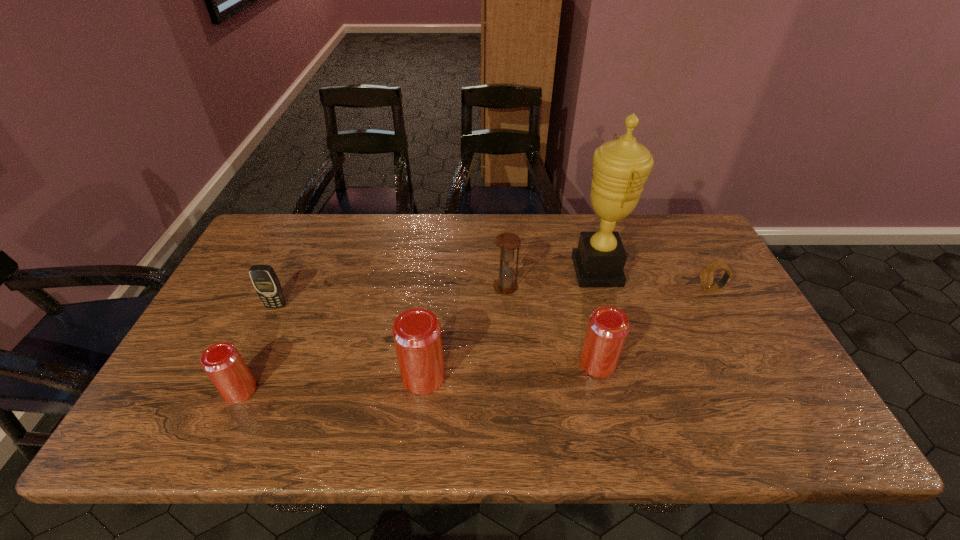
Where is `beer can positioned at the left edge`? The width and height of the screenshot is (960, 540). beer can positioned at the left edge is located at coordinates (222, 362).

The image size is (960, 540). In order to click on cellular telephone at the left edge in this screenshot , I will do `click(266, 283)`.

Where is `object at the right edge`? This screenshot has height=540, width=960. object at the right edge is located at coordinates (706, 274).

Identify the location of object present at the near left corner. (222, 362).

In the image, there is a desktop. Where is `free space at the far edge`? This screenshot has width=960, height=540. free space at the far edge is located at coordinates (540, 253).

The height and width of the screenshot is (540, 960). Identify the location of vacant space at the near edge of the desktop. (412, 403).

Find the location of a particular element. The width and height of the screenshot is (960, 540). free space at the left edge is located at coordinates pos(197,366).

What are the coordinates of `vacant region at the far right corner of the desktop` in the screenshot? It's located at (711, 256).

At what (x,y) coordinates should I click in order to perform the action: click on vacant area that lies between the second beer can from left to right and the cellular telephone. Please return your answer as a coordinate pair (x, y). Image resolution: width=960 pixels, height=540 pixels. Looking at the image, I should click on (350, 341).

The width and height of the screenshot is (960, 540). Find the location of `vacant space in between the fourth farthest object and the shortest beer can`. vacant space in between the fourth farthest object and the shortest beer can is located at coordinates (258, 348).